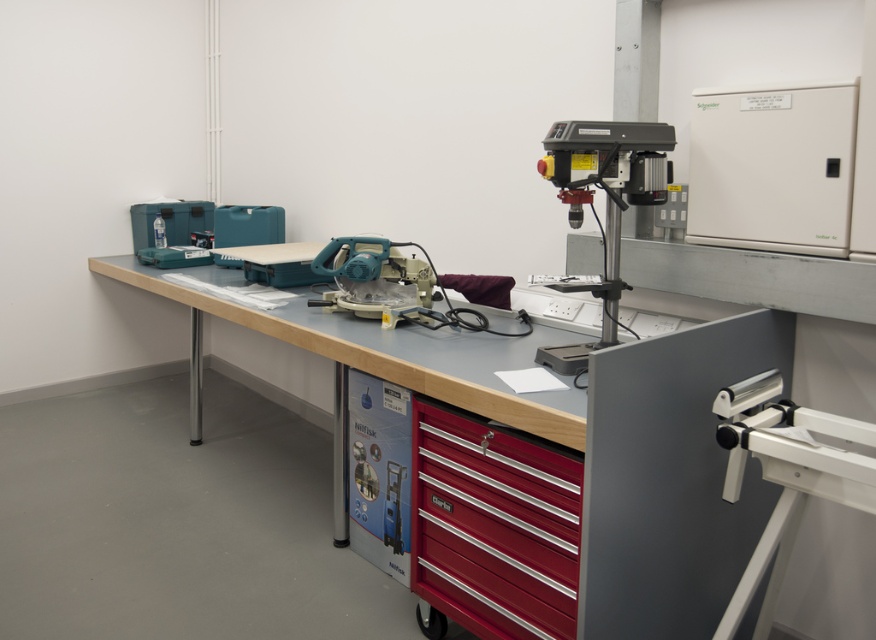
Question: Is red metallic drawer at center bigger than matte plastic circular saw at center?

Choices:
 (A) no
 (B) yes

Answer: (B)

Question: Which object is farther from the camera taking this photo?

Choices:
 (A) metallic gray drill press at upper right
 (B) metallic gray table at center
 (C) red metallic drawer at center

Answer: (A)

Question: Does red metallic drawer at center appear on the right side of metallic gray table at center?

Choices:
 (A) no
 (B) yes

Answer: (B)

Question: Does red metallic drawer at center appear over metallic gray drill press at upper right?

Choices:
 (A) yes
 (B) no

Answer: (B)

Question: Which point is farther to the camera?

Choices:
 (A) metallic gray table at center
 (B) matte plastic circular saw at center

Answer: (B)

Question: Which of the following is the closest to the observer?

Choices:
 (A) metallic gray drill press at upper right
 (B) matte plastic circular saw at center

Answer: (A)